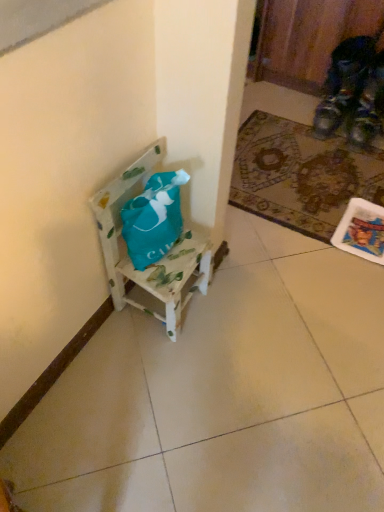
I want to click on free point above patterned carpet at lower right (from a real-world perspective), so click(x=307, y=172).